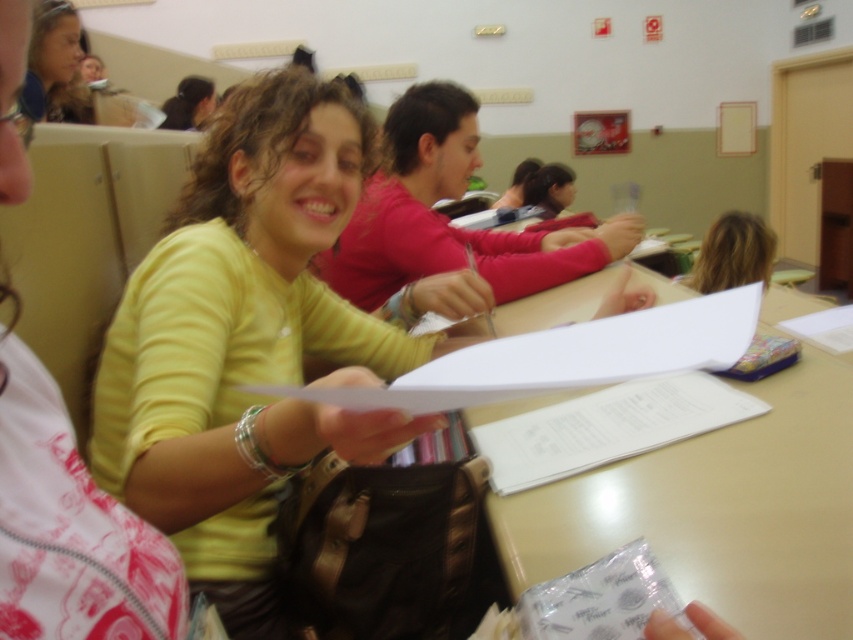
Question: Among these objects, which one is nearest to the camera?

Choices:
 (A) yellow matte sweater at center
 (B) matte yellow shirt at upper left

Answer: (A)

Question: Can you confirm if yellow matte sweater at center is wider than matte yellow shirt at upper left?

Choices:
 (A) no
 (B) yes

Answer: (A)

Question: Can you confirm if yellow matte sweater at center is thinner than matte yellow shirt at upper left?

Choices:
 (A) yes
 (B) no

Answer: (A)

Question: Can you confirm if yellow matte sweater at center is wider than matte yellow shirt at upper left?

Choices:
 (A) no
 (B) yes

Answer: (A)

Question: Which of the following is the farthest from the observer?

Choices:
 (A) matte yellow shirt at upper left
 (B) yellow matte sweater at center

Answer: (A)

Question: Which of the following is the farthest from the observer?

Choices:
 (A) (61, 115)
 (B) (292, 337)

Answer: (A)